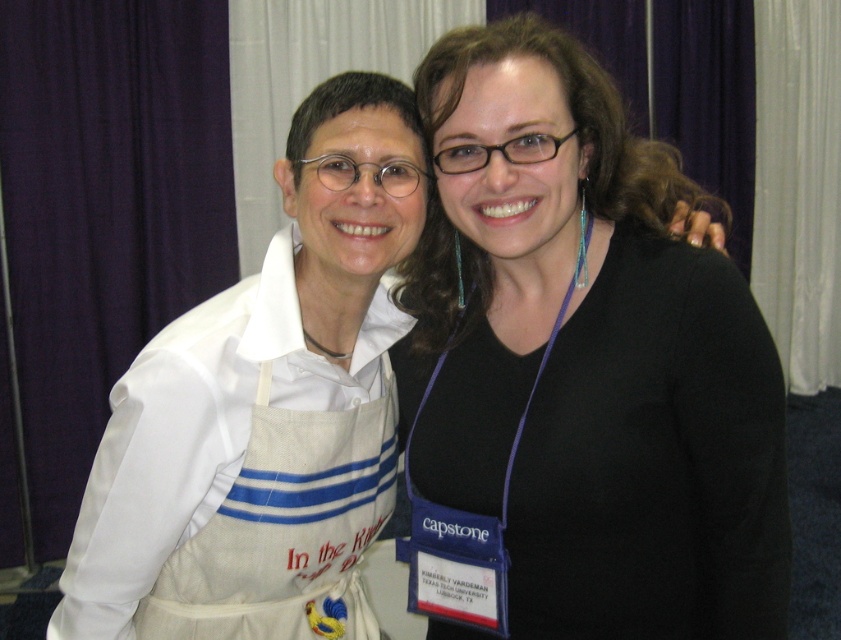
Question: Is black matte shirt at center positioned at the back of white fabric apron at left?

Choices:
 (A) no
 (B) yes

Answer: (A)

Question: Does white fabric apron at left have a greater width compared to whitecanvasapron at left?

Choices:
 (A) yes
 (B) no

Answer: (A)

Question: Is black matte shirt at center above white fabric apron at left?

Choices:
 (A) no
 (B) yes

Answer: (B)

Question: Which point appears closest to the camera in this image?

Choices:
 (A) (229, 572)
 (B) (284, 426)
 (C) (759, 630)

Answer: (B)

Question: Which object is the closest to the whitecanvasapron at left?

Choices:
 (A) white fabric apron at left
 (B) black matte shirt at center

Answer: (A)

Question: Which object is positioned closest to the black matte shirt at center?

Choices:
 (A) whitecanvasapron at left
 (B) white fabric apron at left

Answer: (B)